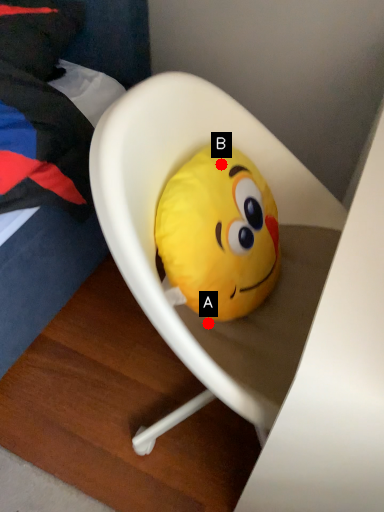
Question: Two points are circled on the image, labeled by A and B beside each circle. Which point is closer to the camera?

Choices:
 (A) A is closer
 (B) B is closer

Answer: (B)